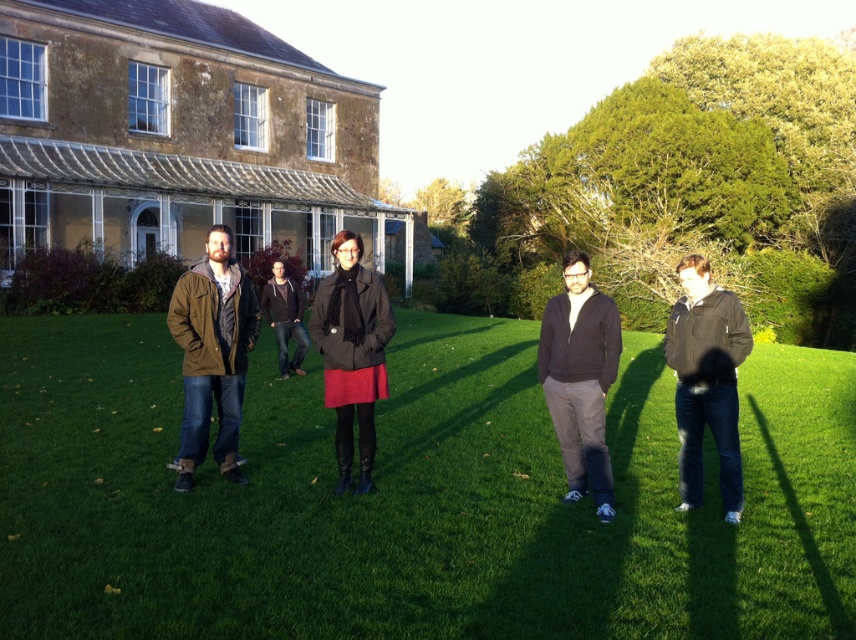
Does green grass at center lie behind dark gray sweater at center?

No, green grass at center is in front of dark gray sweater at center.

Who is more forward, (443, 314) or (268, 282)?

Point (268, 282) is more forward.

This screenshot has width=856, height=640. I want to click on green grass at center, so [411, 497].

The width and height of the screenshot is (856, 640). What do you see at coordinates (212, 353) in the screenshot?
I see `matte brown jacket at left` at bounding box center [212, 353].

You are a GUI agent. You are given a task and a screenshot of the screen. Output one action in this format:
    pyautogui.click(x=<x>, y=<y>)
    Task: Click on the matte brown jacket at left
    The width and height of the screenshot is (856, 640).
    Given the screenshot: What is the action you would take?
    pyautogui.click(x=212, y=353)

Who is positioned more to the right, matte brown jacket at left or dark gray fleece jacket at center?

From the viewer's perspective, dark gray fleece jacket at center appears more on the right side.

Is point (224, 456) positioned before point (575, 499)?

No, it is not.

Image resolution: width=856 pixels, height=640 pixels. Identify the location of matte brown jacket at left. (212, 353).